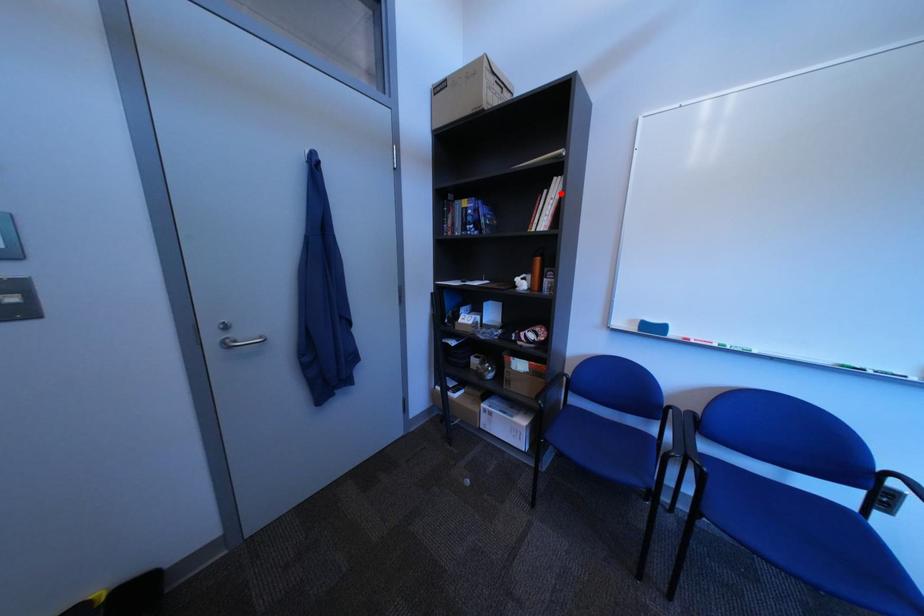
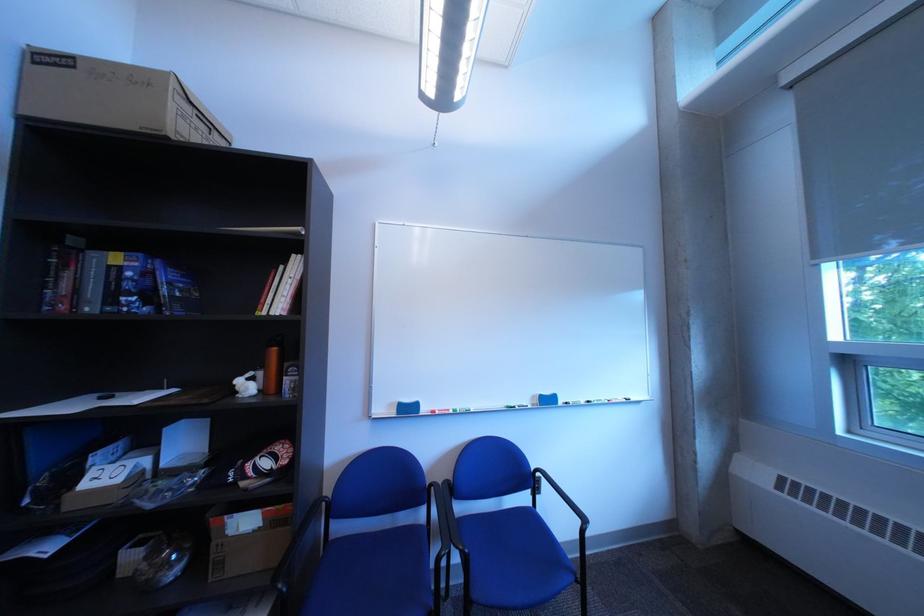
Where in the second image is the point corresponding to the highlighted location from the first image?

(297, 270)